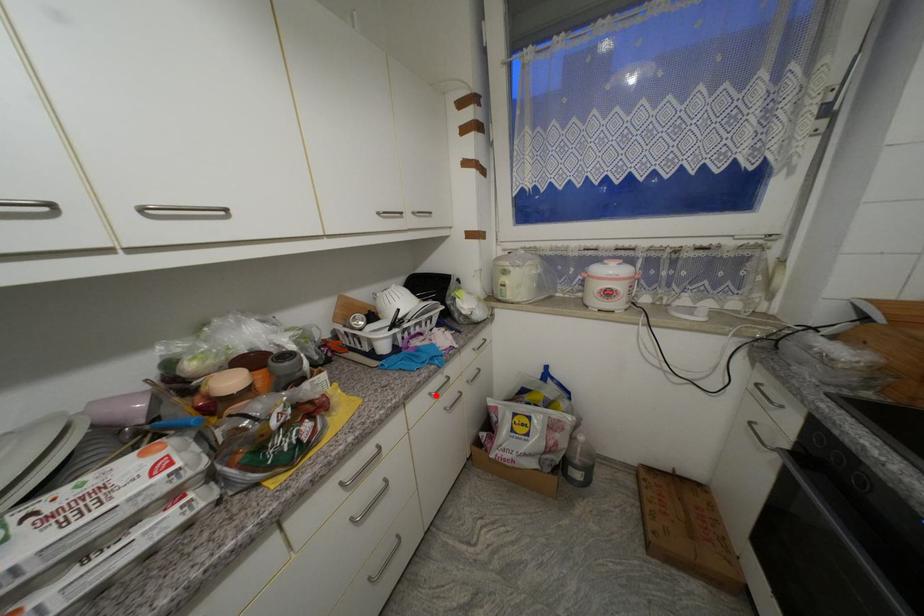
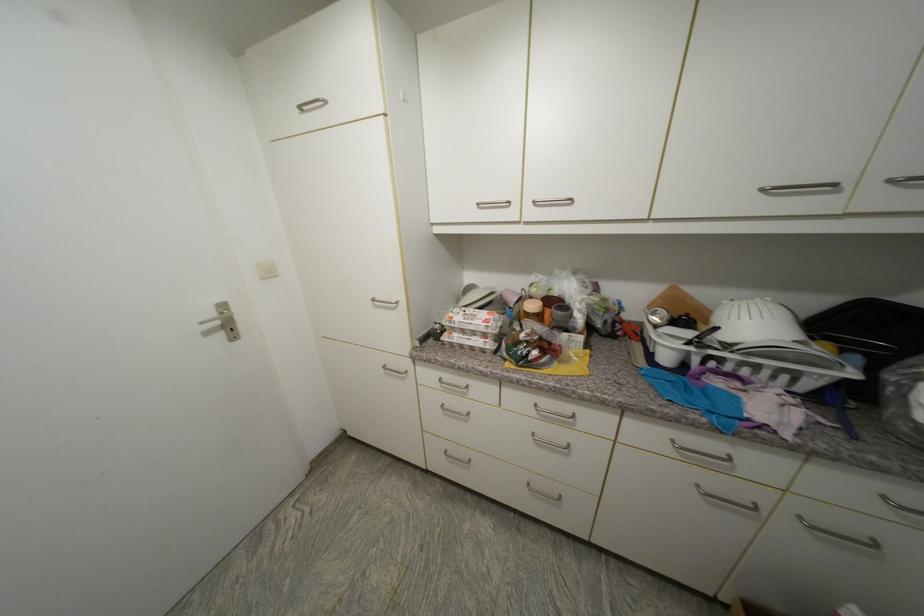
Where in the second image is the point corresponding to the highlighted location from the first image?

(678, 443)